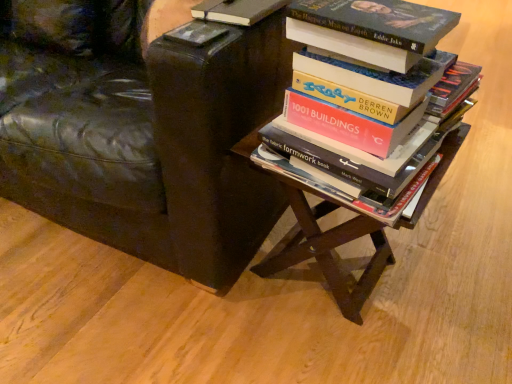
The image size is (512, 384). In order to click on free space in front of wooden table at center in this screenshot , I will do `click(336, 356)`.